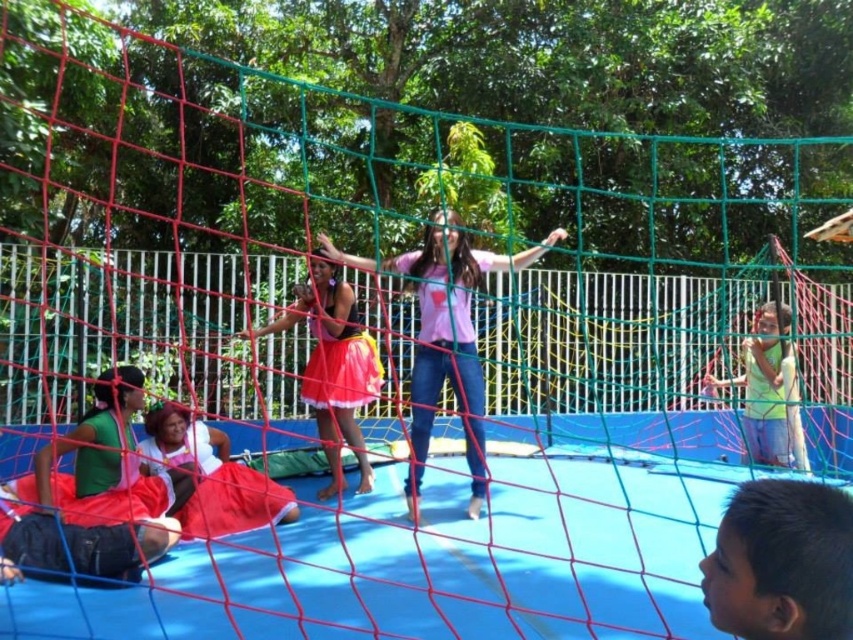
Question: Which of the following is the farthest from the observer?

Choices:
 (A) (343, 406)
 (B) (415, 509)

Answer: (A)

Question: Among these points, which one is farthest from the camera?

Choices:
 (A) (421, 465)
 (B) (744, 372)
 (C) (199, 424)

Answer: (B)

Question: In this image, where is matte red dress at lower left located relative to green matte shirt at upper right?

Choices:
 (A) left
 (B) right

Answer: (A)

Question: Among these objects, which one is nearest to the camera?

Choices:
 (A) matte red dress at lower left
 (B) pink satin skirt at center

Answer: (A)

Question: Is pink satin skirt at center above matte red dress at lower left?

Choices:
 (A) no
 (B) yes

Answer: (B)

Question: Can you confirm if pink matte skirt at center is positioned to the left of pink satin skirt at center?

Choices:
 (A) no
 (B) yes

Answer: (A)